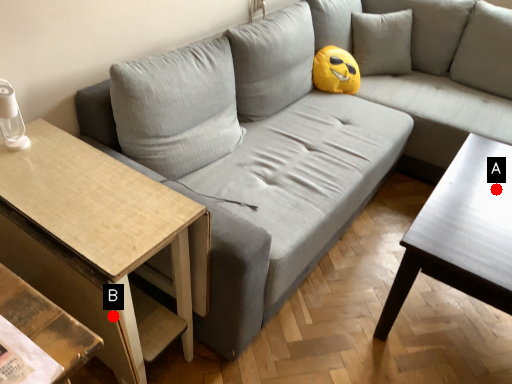
Question: Two points are circled on the image, labeled by A and B beside each circle. Which point appears farthest from the camera in this image?

Choices:
 (A) A is further
 (B) B is further

Answer: (A)